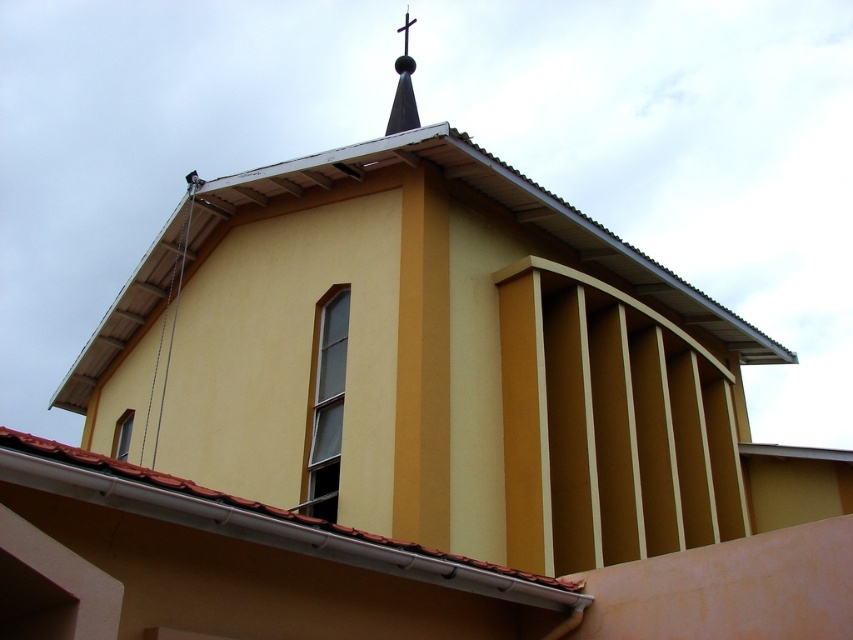
Question: Which object is farther from the camera taking this photo?

Choices:
 (A) metallic cross at upper center
 (B) glossy metal spire at upper center
 (C) brown tile roof at lower left
 (D) metallic gray roof at upper center

Answer: (A)

Question: In this image, where is glossy metal spire at upper center located relative to metallic cross at upper center?

Choices:
 (A) left
 (B) right

Answer: (A)

Question: Can you confirm if brown tile roof at lower left is wider than glossy metal spire at upper center?

Choices:
 (A) yes
 (B) no

Answer: (A)

Question: Estimate the real-world distances between objects in this image. Which object is farther from the metallic cross at upper center?

Choices:
 (A) metallic gray roof at upper center
 (B) brown tile roof at lower left

Answer: (B)

Question: Which point is closer to the camera taking this photo?

Choices:
 (A) (405, 12)
 (B) (399, 100)

Answer: (B)

Question: Where is brown tile roof at lower left located in relation to metallic cross at upper center in the image?

Choices:
 (A) below
 (B) above

Answer: (A)